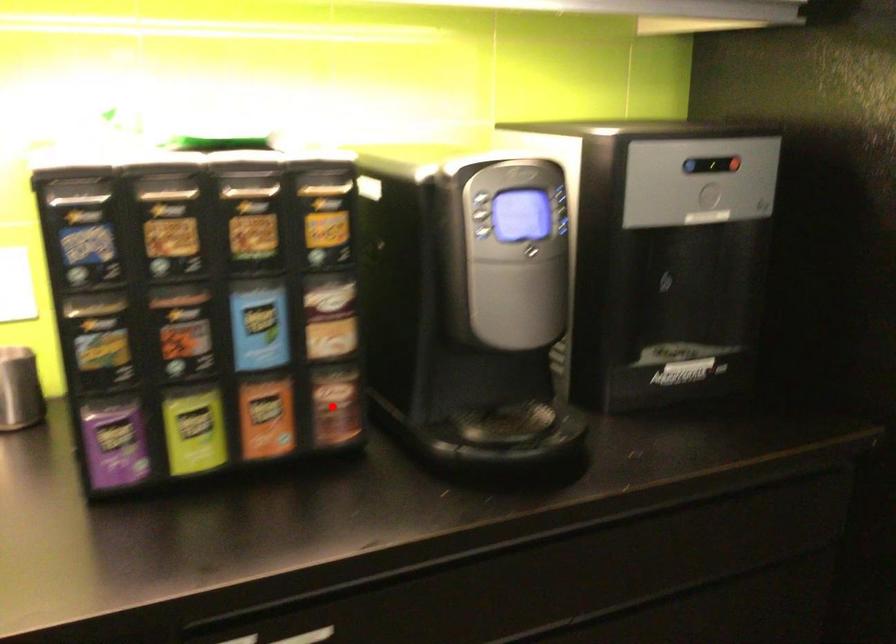
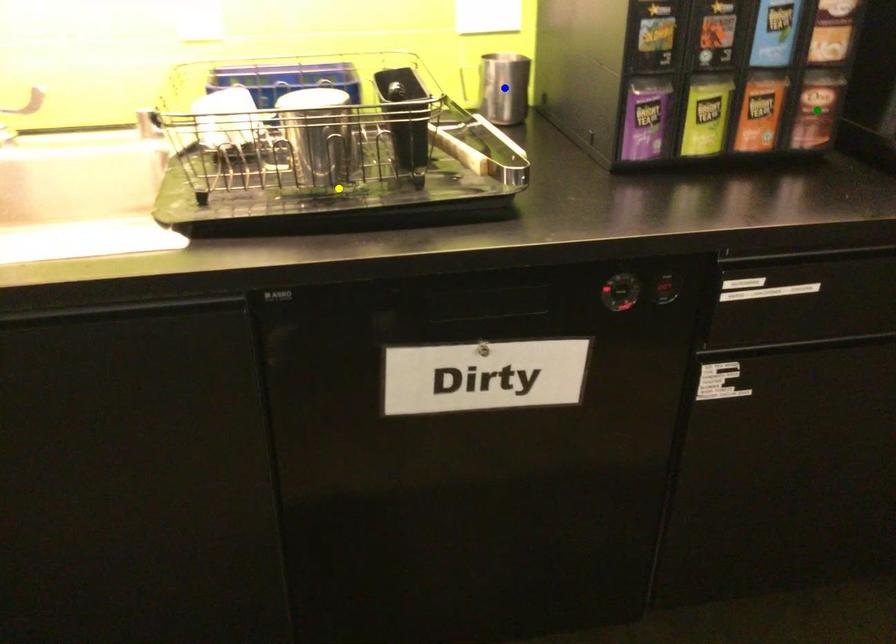
Question: I am providing you with two images of the same scene from different viewpoints. A red point is marked on the first image. You are given multiple points on the second image. In image 2, which mark is for the same physical point as the one in image 1?

Choices:
 (A) yellow point
 (B) green point
 (C) blue point

Answer: (B)